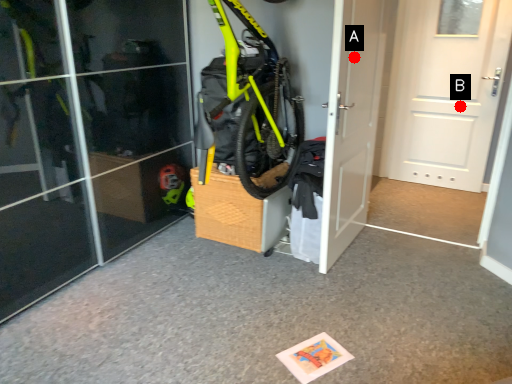
Question: Two points are circled on the image, labeled by A and B beside each circle. Which point is farther from the camera taking this photo?

Choices:
 (A) A is further
 (B) B is further

Answer: (B)